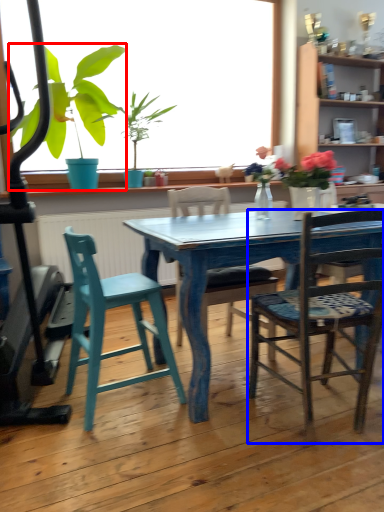
Question: Among these objects, which one is farthest to the camera, houseplant (highlighted by a red box) or chair (highlighted by a blue box)?

Choices:
 (A) houseplant
 (B) chair

Answer: (A)